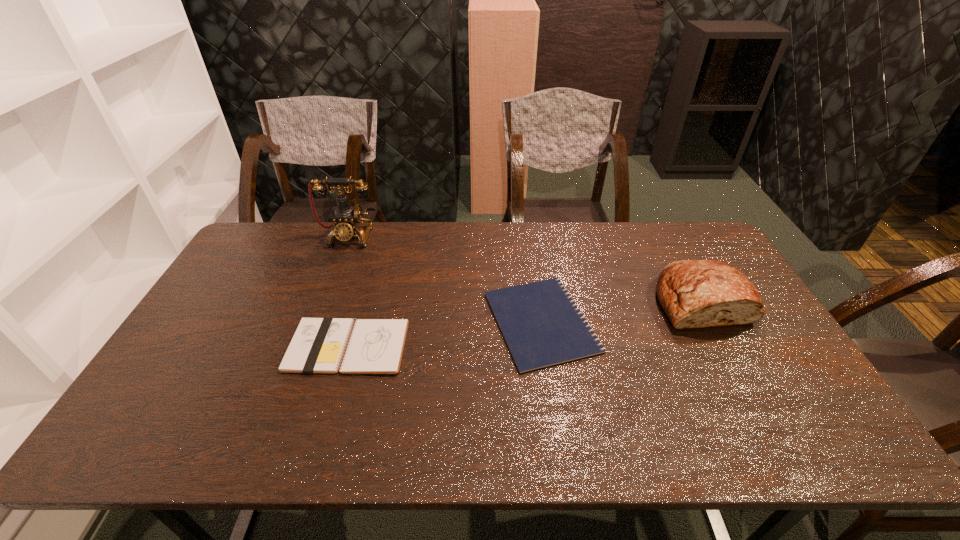
Where is `vacant space that satisfies the following two spatial constraints: 1. on the front of the taller notepad, featuring the rotary dial; 2. on the right side of the tallest object`? This screenshot has width=960, height=540. vacant space that satisfies the following two spatial constraints: 1. on the front of the taller notepad, featuring the rotary dial; 2. on the right side of the tallest object is located at coordinates (307, 346).